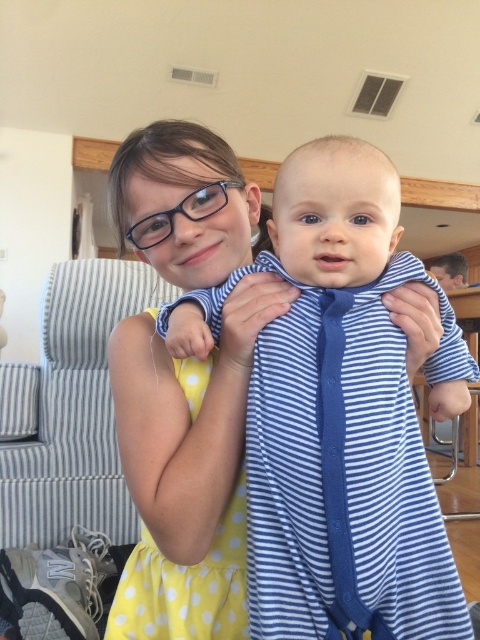
Question: Where is blue striped onesie at center located in relation to yellow polka dot dress at center in the image?

Choices:
 (A) left
 (B) right

Answer: (B)

Question: Can you confirm if blue striped onesie at center is positioned to the left of yellow polka dot dress at center?

Choices:
 (A) no
 (B) yes

Answer: (A)

Question: Which of the following is the farthest from the observer?

Choices:
 (A) blue striped onesie at center
 (B) yellow polka dot dress at center

Answer: (B)

Question: Which of the following is the farthest from the observer?

Choices:
 (A) (135, 630)
 (B) (415, 417)

Answer: (A)

Question: Is blue striped onesie at center closer to the viewer compared to yellow polka dot dress at center?

Choices:
 (A) yes
 (B) no

Answer: (A)

Question: Which point is farther from the camera taking this photo?

Choices:
 (A) pos(239,509)
 (B) pos(301,301)

Answer: (A)